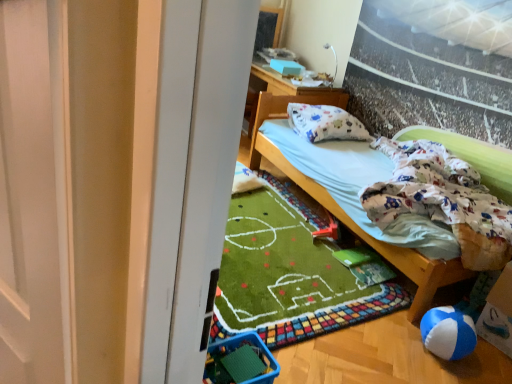
Question: Looking at their shapes, would you say white fabric pillow at upper center is wider or thinner than red plastic toy at lower center?

Choices:
 (A) thin
 (B) wide

Answer: (B)

Question: Relative to red plastic toy at lower center, is white fabric pillow at upper center in front or behind?

Choices:
 (A) front
 (B) behind

Answer: (B)

Question: Which object is the farthest from the blue plastic baby carriage at lower left?

Choices:
 (A) white fabric pillow at upper center
 (B) white cotton mattress at center
 (C) white cotton pillow at upper center
 (D) red plastic toy at lower center
 (E) blue sponge ball at lower right

Answer: (A)

Question: Which object is positioned closest to the blue plastic baby carriage at lower left?

Choices:
 (A) white cotton mattress at center
 (B) blue sponge ball at lower right
 (C) white cotton pillow at upper center
 (D) red plastic toy at lower center
 (E) white fabric pillow at upper center

Answer: (B)